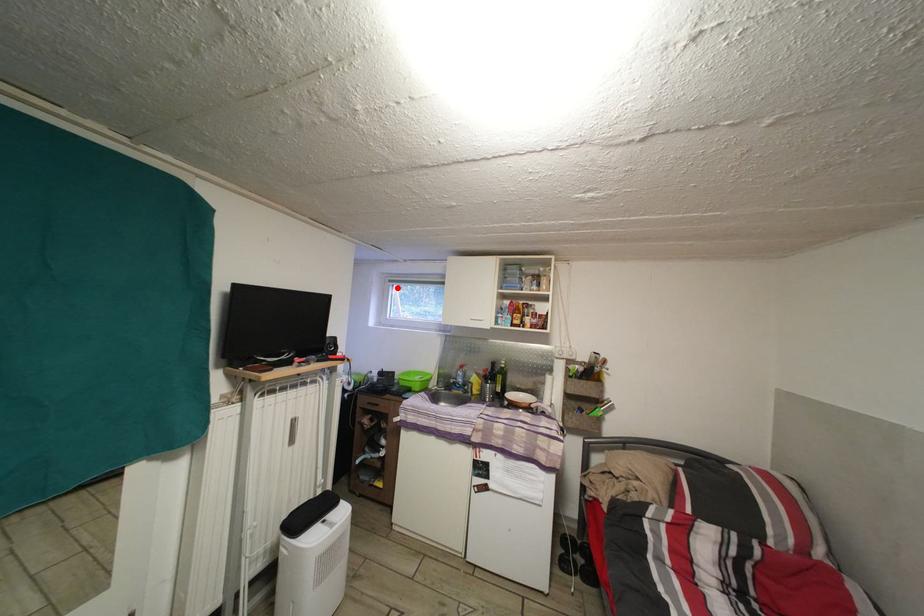
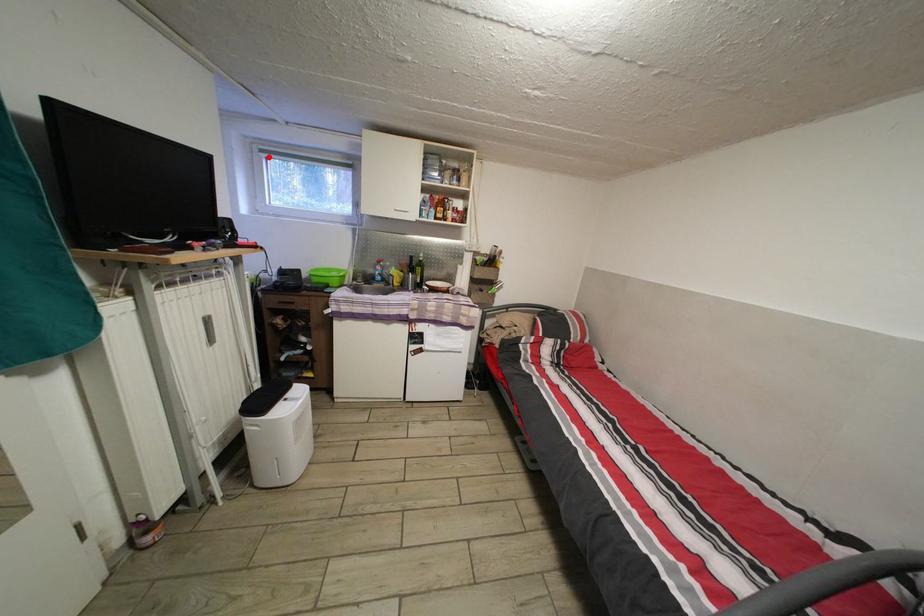
I am providing you with two images of the same scene from different viewpoints. A red point is marked on the first image and another point is marked on the second image. Are the points marked in image1 and image2 representing the same 3D position?

Yes